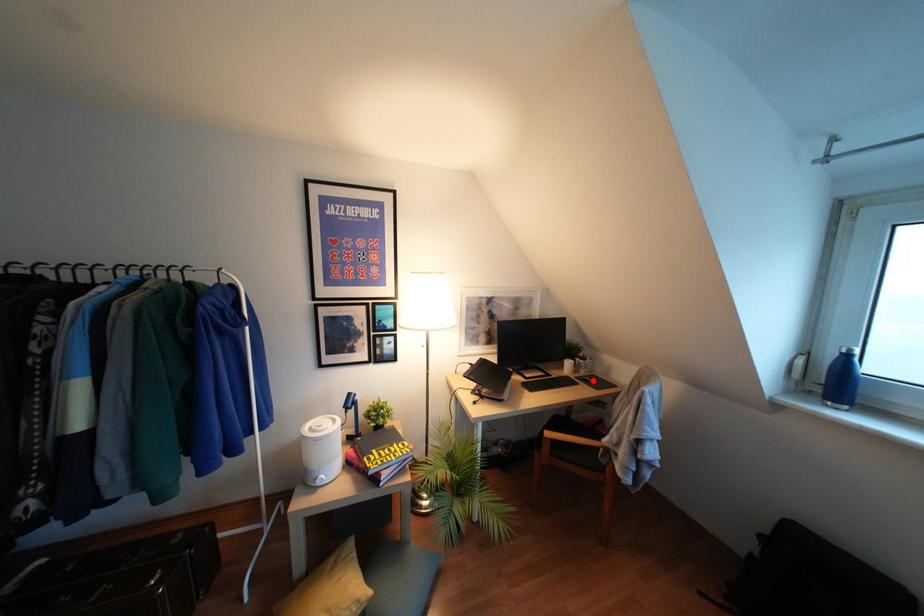
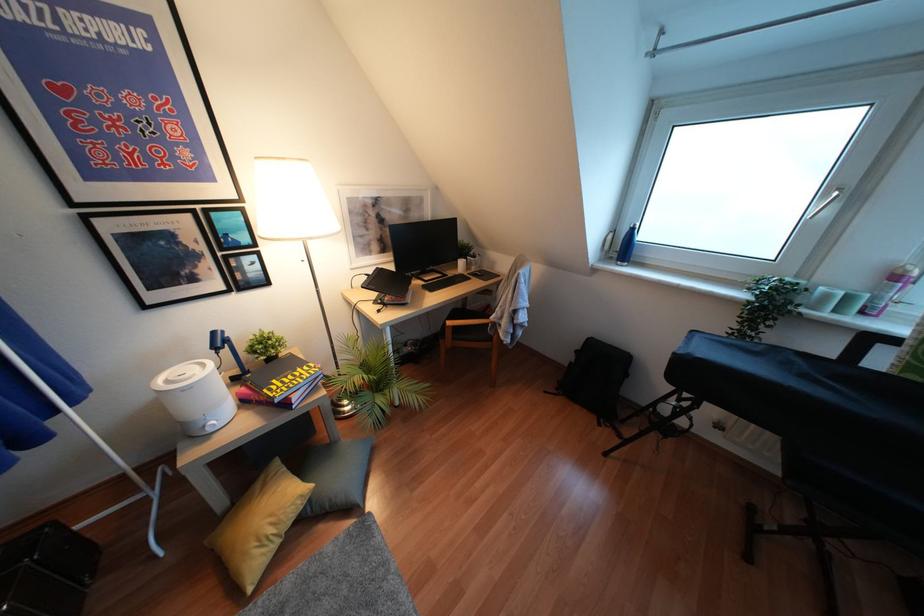
Question: A red point is marked in image1. In image2, is the corresponding 3D point closer to the camera or farther? Reply with the corresponding letter.

Choices:
 (A) The corresponding 3D point is closer.
 (B) The corresponding 3D point is farther.

Answer: (A)